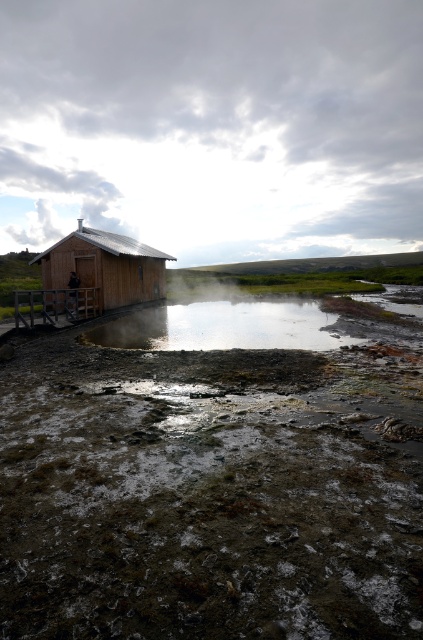
You are a hiker trying to cross the area near the wooden hut. You have a map showing coordinates. Where exactly is the muddy wet ground at lower left located?

The muddy wet ground at lower left is located at coordinates point (214, 484).

You are a hiker who needs to cross from the muddy wet ground at lower left to the clear water at center. Given that your hiking boots can handle up to 10 feet of distance, can you safely make the jump?

The muddy wet ground at lower left and clear water at center are 12.51 feet apart. Since your hiking boots can only handle up to 10 feet, you cannot safely make the jump as the distance exceeds the safe limit.